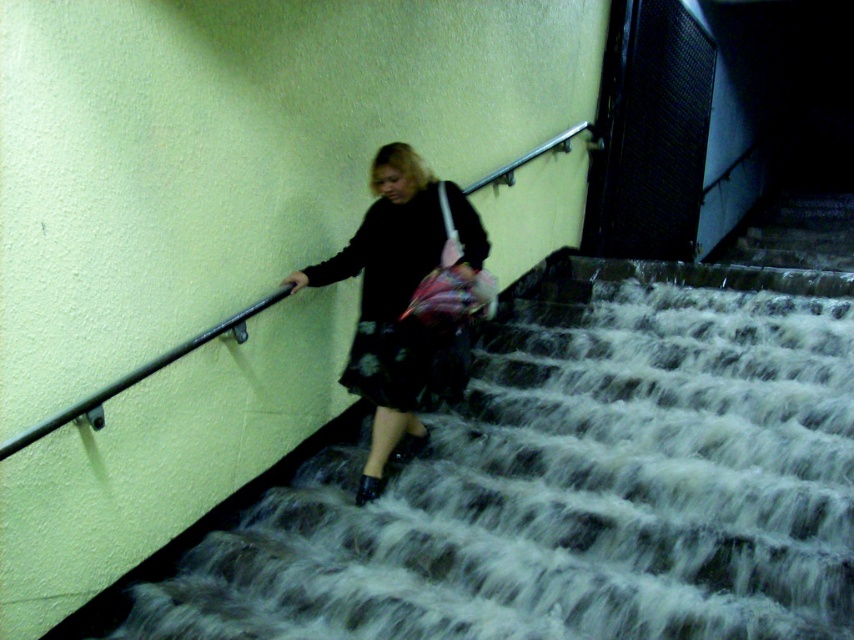
Question: Which object appears closest to the camera in this image?

Choices:
 (A) matte black dress at center
 (B) smooth concrete stairs at center

Answer: (B)

Question: Can you confirm if smooth concrete stairs at center is smaller than matte black dress at center?

Choices:
 (A) no
 (B) yes

Answer: (A)

Question: Does smooth concrete stairs at center have a smaller size compared to matte black dress at center?

Choices:
 (A) yes
 (B) no

Answer: (B)

Question: Can you confirm if smooth concrete stairs at center is positioned below matte black dress at center?

Choices:
 (A) yes
 (B) no

Answer: (A)

Question: Which point is closer to the camera?

Choices:
 (A) smooth concrete stairs at center
 (B) matte black dress at center

Answer: (A)

Question: Which object is closer to the camera taking this photo?

Choices:
 (A) matte black dress at center
 (B) smooth concrete stairs at center

Answer: (B)